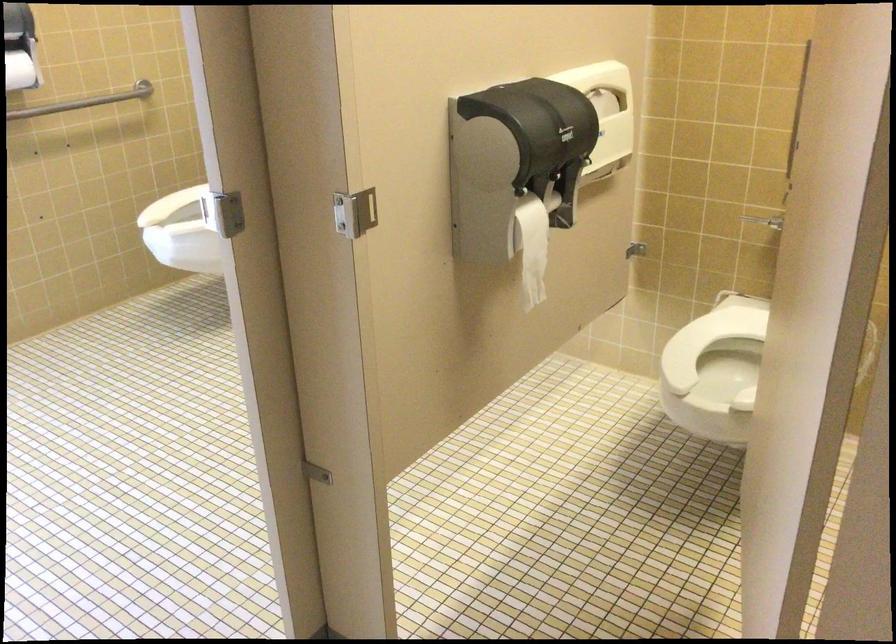
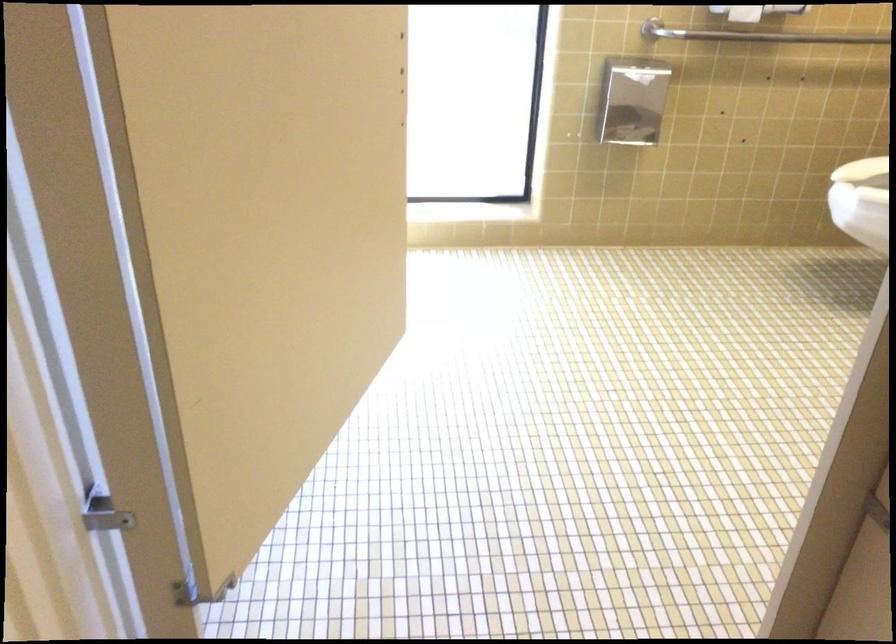
Question: The camera is either moving clockwise (left) or counter-clockwise (right) around the object. The first image is from the beginning of the video and the second image is from the end. Is the camera moving left or right when shooting the video?

Choices:
 (A) Left
 (B) Right

Answer: (B)